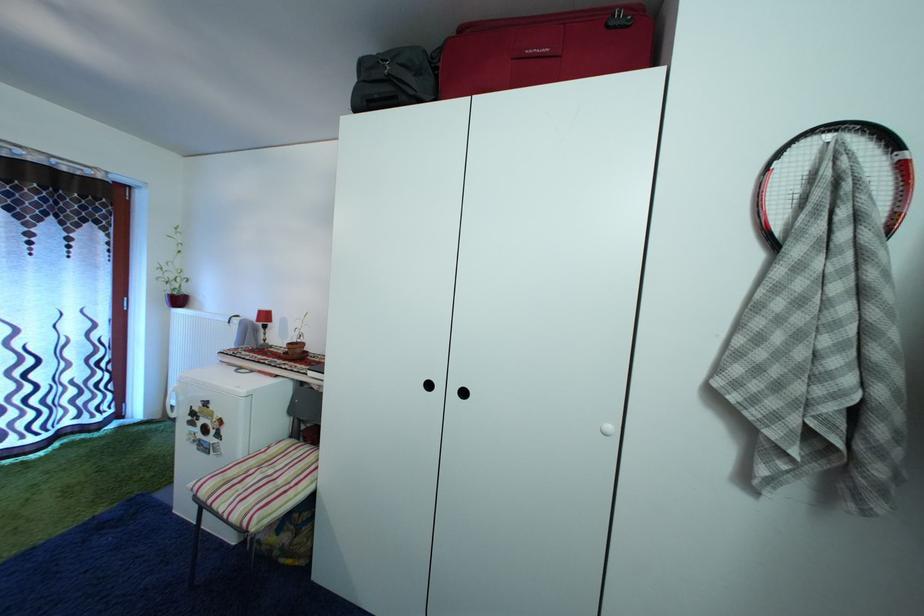
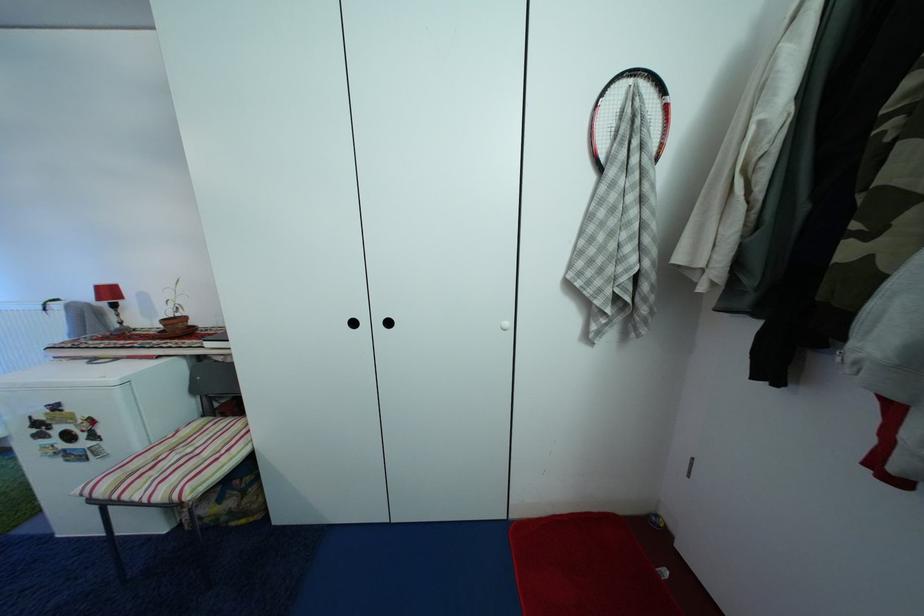
Where in the second image is the point corresponding to pixel 268 320 from the first image?

(106, 294)